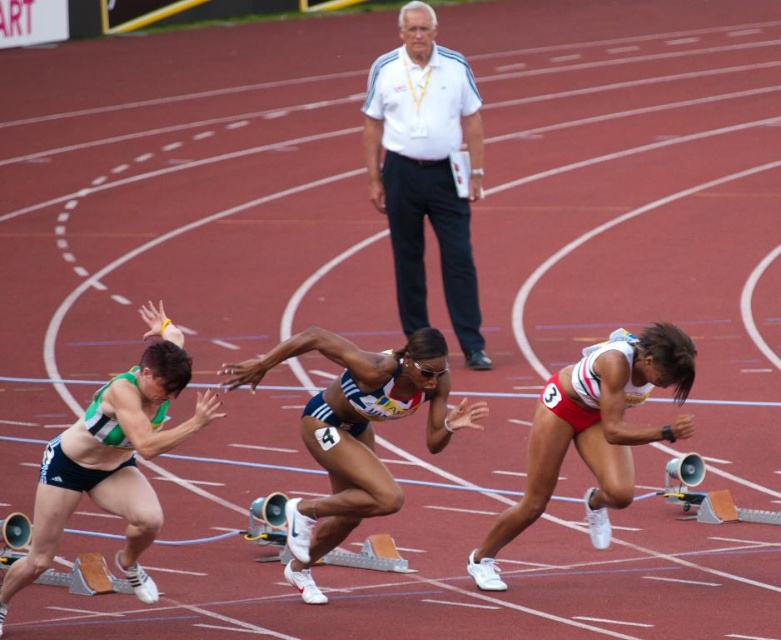
You are a photographer positioned at the finish line of the sprint race. You need to capture a photo of the athletes as they cross the line. The camera you are using has a height requirement for the subjects to be in focus. The minimum focus height is 1.6 meters. Based on the description, will both the white athletic uniform at center and the green matte shorts at left be in focus?

The white athletic uniform at center is shorter than the green matte shorts at left. Since the minimum focus height is 1.6 meters, we need to know their actual heights. However, the description only provides a relative comparison between them. Without specific height measurements, we cannot definitively determine if both will be in focus. The green matte shorts at left is taller than the white athletic uniform at center, but without knowing if the taller one meets or exceeds 1.6 meters, the answer remains 1

You are a photographer positioned at the finish line of the sprint race. You want to capture a photo that includes both the white athletic uniform at center and the white matte running shoe at lower right. Considering their sizes, which object should you focus on to ensure both are clearly visible in the frame?

The white athletic uniform at center is larger in width than the white matte running shoe at lower right, so focusing on the white athletic uniform at center will help ensure both objects are clearly visible in the frame.